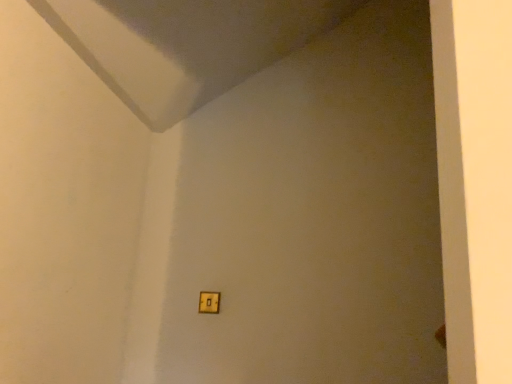
You are a GUI agent. You are given a task and a screenshot of the screen. Output one action in this format:
    pyautogui.click(x=<x>, y=<y>)
    Task: Click on the gold metallic light switch at center
    Image resolution: width=512 pixels, height=384 pixels.
    Given the screenshot: What is the action you would take?
    pyautogui.click(x=209, y=302)

Image resolution: width=512 pixels, height=384 pixels. Describe the element at coordinates (209, 302) in the screenshot. I see `gold metallic light switch at center` at that location.

What is the approximate height of gold metallic light switch at center?

gold metallic light switch at center is 3.70 inches tall.

Locate an element on the screen. This screenshot has height=384, width=512. gold metallic light switch at center is located at coordinates (209, 302).